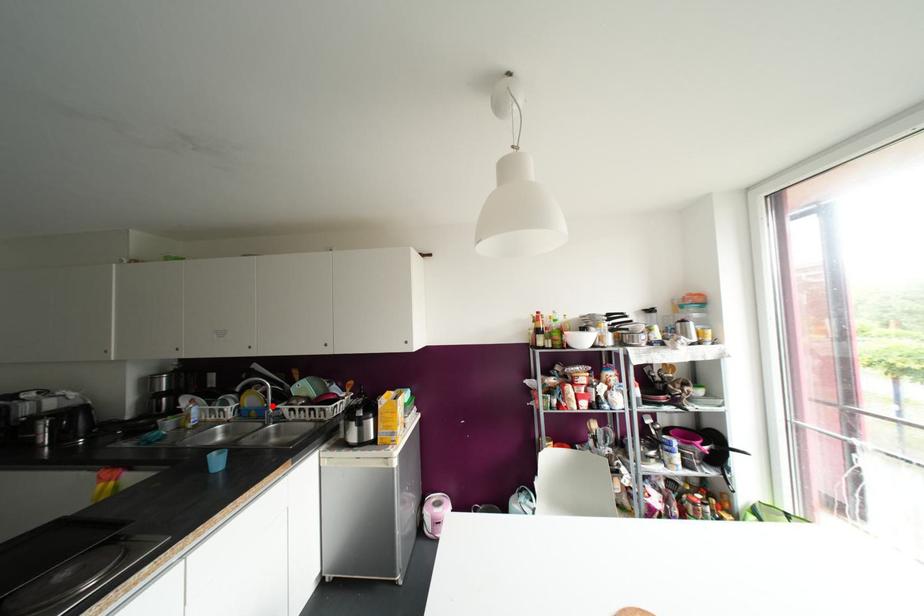
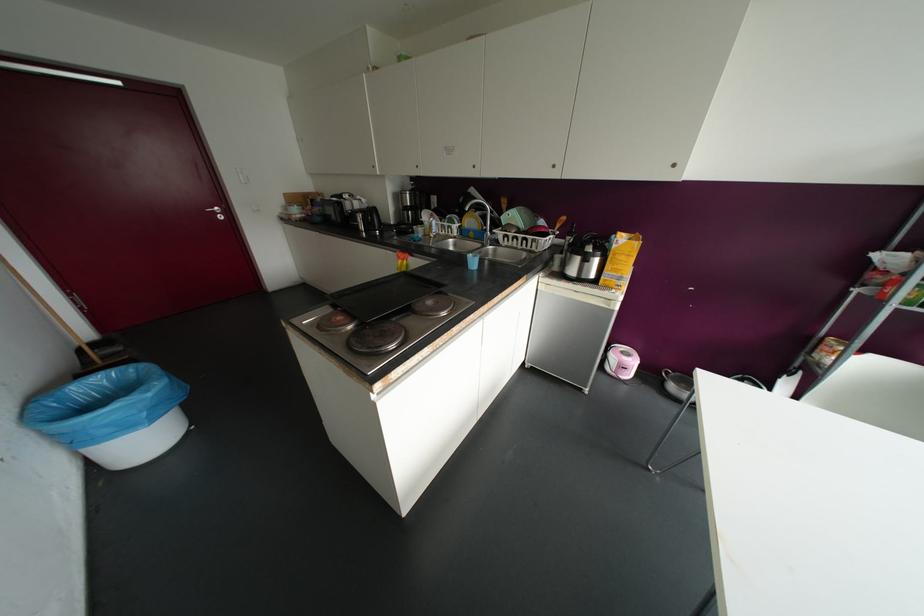
Question: I am providing you with two images of the same scene from different viewpoints. A red point is shown in image1. For the corresponding object point in image2, is it positioned nearer or farther from the camera?

Choices:
 (A) Nearer
 (B) Farther

Answer: (A)